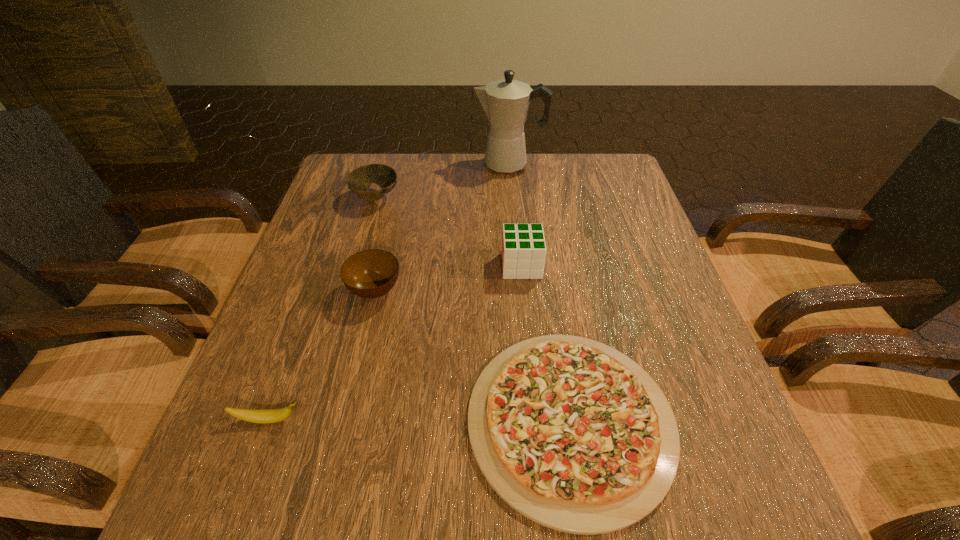
Where is `vacant space that is in between the farthest object and the second shortest object`? This screenshot has width=960, height=540. vacant space that is in between the farthest object and the second shortest object is located at coordinates (389, 292).

Locate an element on the screen. This screenshot has width=960, height=540. vacant area that lies between the cube and the farther bowl is located at coordinates (448, 232).

At what (x,y) coordinates should I click in order to perform the action: click on vacant region between the pizza and the banana. Please return your answer as a coordinate pair (x, y). Looking at the image, I should click on (420, 420).

Find the location of a particular element. free space between the banana and the tallest object is located at coordinates (389, 292).

Where is `free space that is in between the farther bowl and the coffeepot`? The height and width of the screenshot is (540, 960). free space that is in between the farther bowl and the coffeepot is located at coordinates (443, 181).

What are the coordinates of `vacant space that's between the banana and the coffeepot` in the screenshot? It's located at (x=389, y=292).

You are a GUI agent. You are given a task and a screenshot of the screen. Output one action in this format:
    pyautogui.click(x=<x>, y=<y>)
    Task: Click on the empty space that is in between the nearer bowl and the second tallest object
    The height and width of the screenshot is (540, 960).
    Given the screenshot: What is the action you would take?
    pyautogui.click(x=448, y=278)

Image resolution: width=960 pixels, height=540 pixels. I want to click on the closest object relative to the cube, so click(574, 435).

This screenshot has height=540, width=960. I want to click on object identified as the third closest to the cube, so click(x=359, y=181).

Locate an element on the screen. free spot that satisfies the following two spatial constraints: 1. on the back side of the pizza; 2. on the red face of the fifth shortest object is located at coordinates (546, 266).